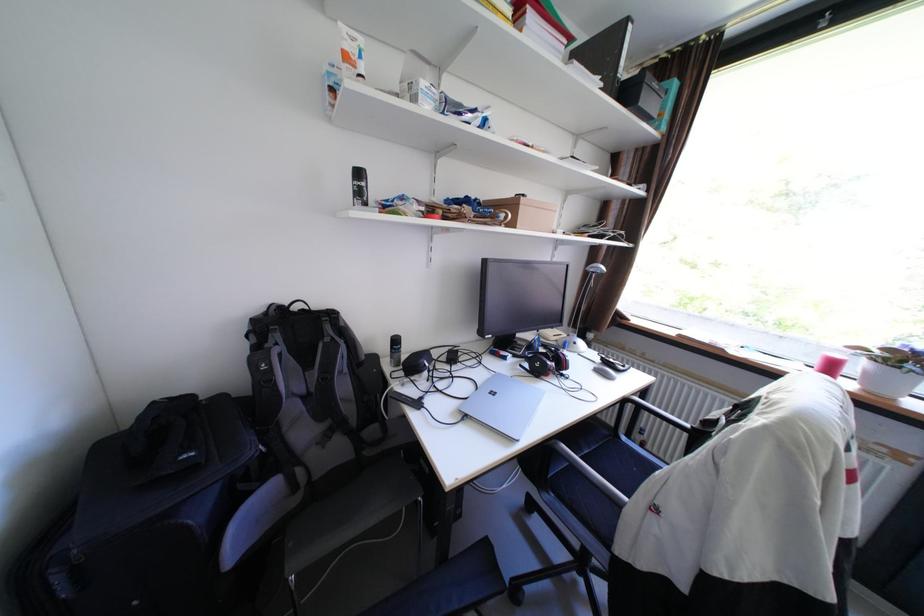
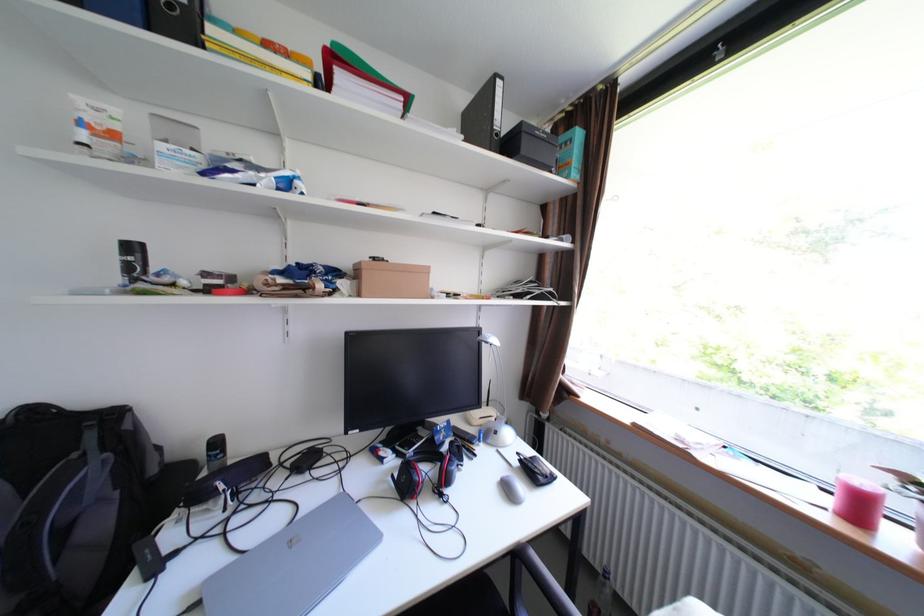
Find the pixel in the second image that matches pixel 355 387 in the first image.

(110, 524)